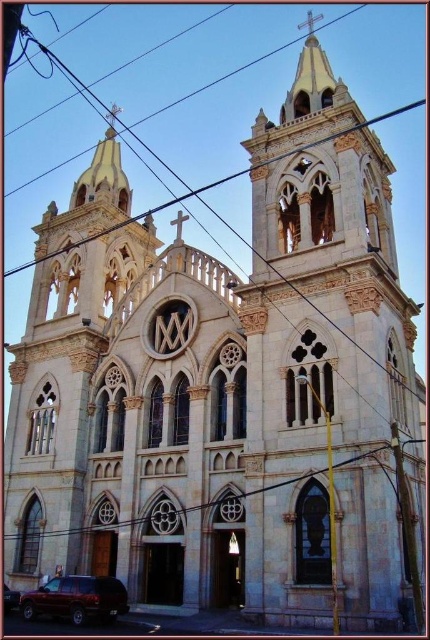
Question: Which point is closer to the camera?

Choices:
 (A) white stone tower at center
 (B) maroon matte suv at lower left
 (C) matte black suv at lower left

Answer: (A)

Question: Does white stone tower at center have a larger size compared to maroon matte suv at lower left?

Choices:
 (A) yes
 (B) no

Answer: (A)

Question: Is white stone tower at center above matte black suv at lower left?

Choices:
 (A) yes
 (B) no

Answer: (A)

Question: Is white stone tower at center thinner than matte black suv at lower left?

Choices:
 (A) no
 (B) yes

Answer: (A)

Question: Which object is closer to the camera taking this photo?

Choices:
 (A) white stone tower at center
 (B) matte black suv at lower left

Answer: (A)

Question: Which point appears closest to the camera in this image?

Choices:
 (A) (8, 589)
 (B) (106, 580)

Answer: (B)